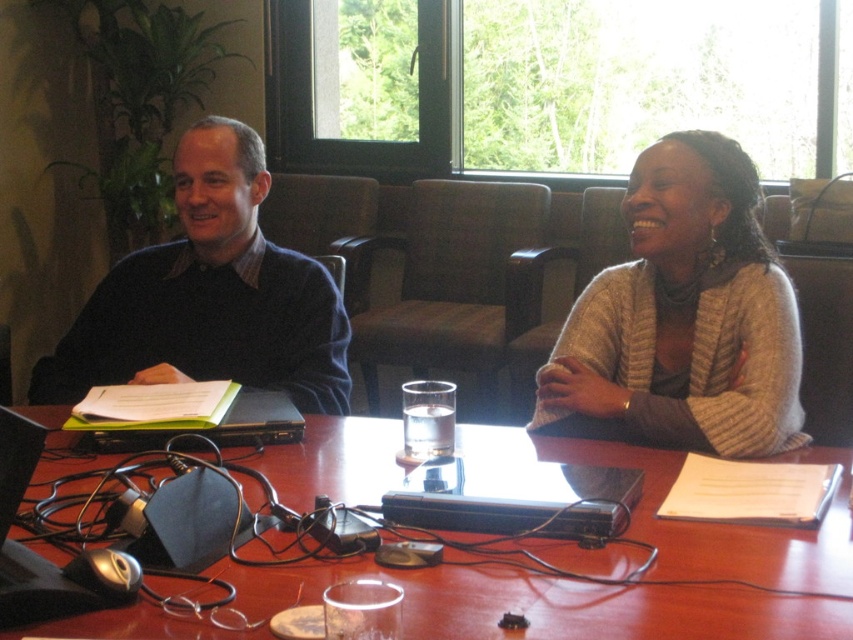
You are an interior designer assessing the seating arrangement in a conference room. You notice the knitted beige sweater at center and the dark blue sweater at upper left. Which sweater takes up more horizontal space on the table?

The dark blue sweater at upper left takes up more horizontal space on the table since it has a greater width than the knitted beige sweater at center.

You are standing in front of the table and want to pick up an item located at point (552, 604) and another item at point (722, 385). Which item will be easier to reach without moving your position?

The item at point (552, 604) will be easier to reach because it is closer to the camera than the item at point (722, 385).

You are trying to decide which sweater to take home from a store. Both the matte black sweater at left and the knitted beige sweater at center are on display. Which one is bigger?

The knitted beige sweater at center is bigger than the matte black sweater at left.